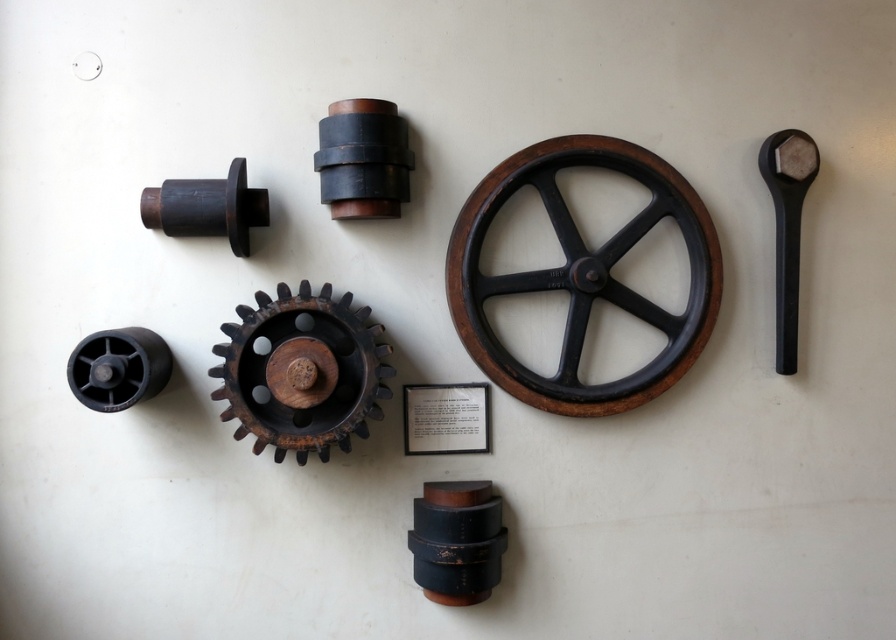
You are standing at a point 5.38 feet away from the point labeled as point (511,276). If you want to move closer to that point, which direction should you move?

Since you are 5.38 feet away from point (511,276), moving forward towards the point would decrease the distance. Therefore, you should move forward to get closer to point (511,276).

You are standing in front of the machinery parts arrangement. There are two points marked in the image. One is at coordinates point (650, 396) and the other is at point (378, 208). Which point is closer to you?

Point (650, 396) is further to the camera than point (378, 208), so the point closer to you is point (378, 208).